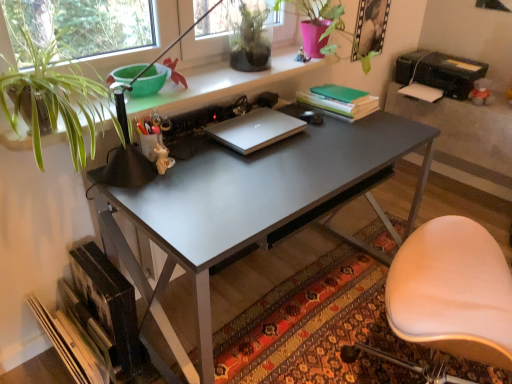
The height and width of the screenshot is (384, 512). Find the location of `free area in between matte gray desk at center and carpeted rug at lower center`. free area in between matte gray desk at center and carpeted rug at lower center is located at coordinates (342, 228).